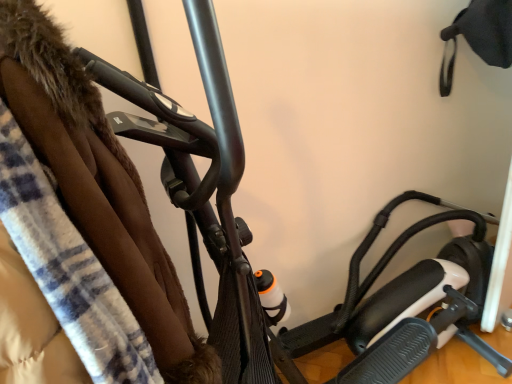
This screenshot has width=512, height=384. I want to click on brown fur coat at left, so click(97, 185).

This screenshot has width=512, height=384. What do you see at coordinates (97, 185) in the screenshot?
I see `brown fur coat at left` at bounding box center [97, 185].

You are a GUI agent. You are given a task and a screenshot of the screen. Output one action in this format:
    pyautogui.click(x=<x>, y=<y>)
    Task: Click on the brown fur coat at left
    Image resolution: width=512 pixels, height=384 pixels.
    Given the screenshot: What is the action you would take?
    pyautogui.click(x=97, y=185)